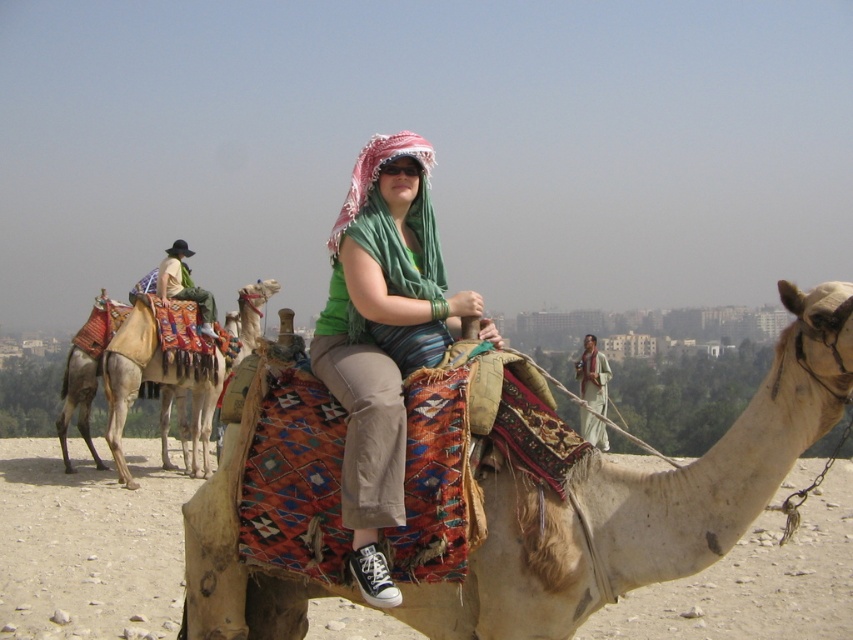
Question: Does beige textured camel at left appear on the left side of green fabric headscarf at center?

Choices:
 (A) yes
 (B) no

Answer: (A)

Question: Is beige textured camel at center positioned at the back of green fabric headscarf at center?

Choices:
 (A) yes
 (B) no

Answer: (B)

Question: Which point is closer to the camera?

Choices:
 (A) (126, 317)
 (B) (592, 481)

Answer: (B)

Question: Which point appears closest to the camera in this image?

Choices:
 (A) (583, 364)
 (B) (236, 356)

Answer: (B)

Question: Which object appears farthest from the camera in this image?

Choices:
 (A) beige textured camel at left
 (B) green fabric scarf at center

Answer: (A)

Question: Can you confirm if beige textured camel at left is positioned to the left of green fabric headscarf at center?

Choices:
 (A) no
 (B) yes

Answer: (B)